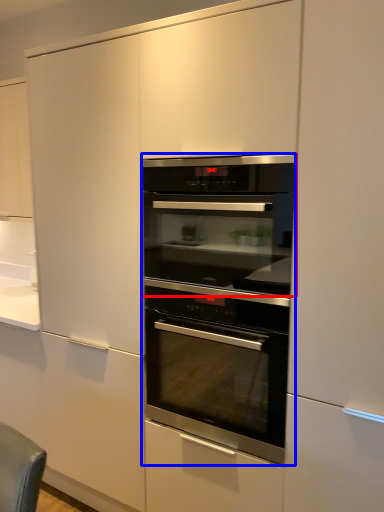
Question: Which object appears closest to the camera in this image, oven (highlighted by a red box) or oven (highlighted by a blue box)?

Choices:
 (A) oven
 (B) oven

Answer: (A)